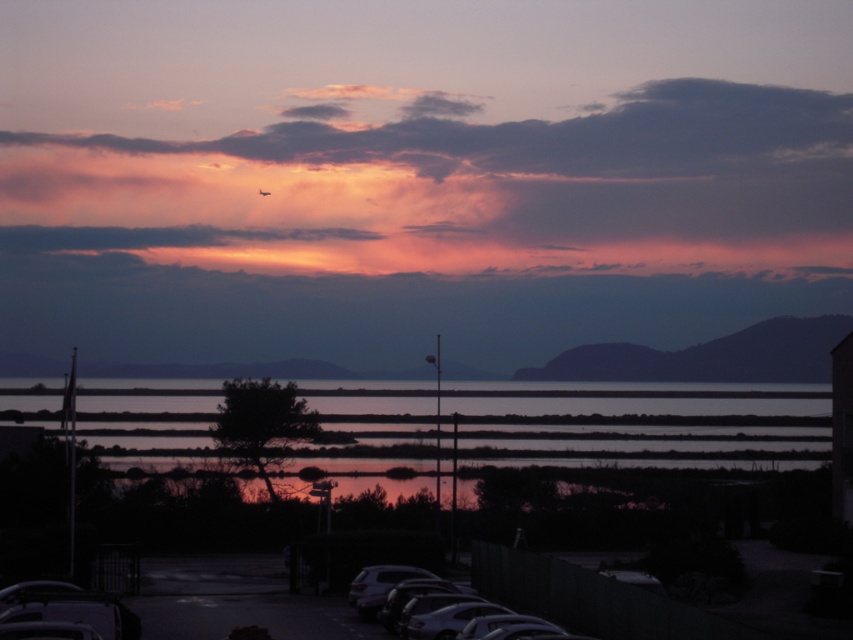
You are an astronomer observing the sunset scene. You notice a point at coordinates (460, 188). What object is located at that point?

The point at coordinates (460, 188) indicates a matte pink cloud at upper center.

You are standing at the point closer to the camera between the two points, point (550, 209) and point (387, 568). Which point are you standing at?

You are standing at point (550, 209) because it is further to the camera than point (387, 568).

You are standing at the edge of the coast watching the sunset and see two points in the sky, one at point (445, 195) and the other at point (485, 600). Which point is closer to you?

Point (445, 195) is further to the viewer than point (485, 600), so the point at (485, 600) is closer to you.